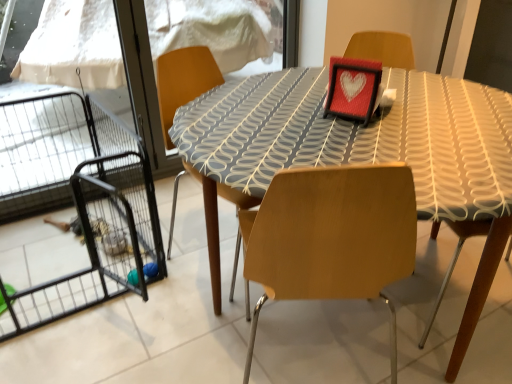
Question: Is black wire cage at left inside matte gray fabric table at center?

Choices:
 (A) yes
 (B) no

Answer: (B)

Question: Does matte gray fabric table at center appear on the left side of black wire cage at left?

Choices:
 (A) yes
 (B) no

Answer: (B)

Question: Is matte gray fabric table at center wider than black wire cage at left?

Choices:
 (A) yes
 (B) no

Answer: (A)

Question: From a real-world perspective, does matte gray fabric table at center stand above black wire cage at left?

Choices:
 (A) yes
 (B) no

Answer: (A)

Question: Could you tell me if matte gray fabric table at center is facing black wire cage at left?

Choices:
 (A) yes
 (B) no

Answer: (B)

Question: Considering the relative positions of matte gray fabric table at center and black wire cage at left in the image provided, is matte gray fabric table at center to the right of black wire cage at left from the viewer's perspective?

Choices:
 (A) no
 (B) yes

Answer: (B)

Question: Does black wire cage at left have a lesser height compared to matte gray fabric table at center?

Choices:
 (A) yes
 (B) no

Answer: (A)

Question: Can you confirm if black wire cage at left is smaller than matte gray fabric table at center?

Choices:
 (A) yes
 (B) no

Answer: (A)

Question: From a real-world perspective, does black wire cage at left sit lower than matte gray fabric table at center?

Choices:
 (A) no
 (B) yes

Answer: (B)

Question: From the image's perspective, is black wire cage at left below matte gray fabric table at center?

Choices:
 (A) no
 (B) yes

Answer: (B)

Question: Does black wire cage at left lie behind matte gray fabric table at center?

Choices:
 (A) yes
 (B) no

Answer: (A)

Question: From a real-world perspective, is black wire cage at left on top of matte gray fabric table at center?

Choices:
 (A) no
 (B) yes

Answer: (A)

Question: Relative to black wire cage at left, is matte gray fabric table at center in front or behind?

Choices:
 (A) front
 (B) behind

Answer: (A)